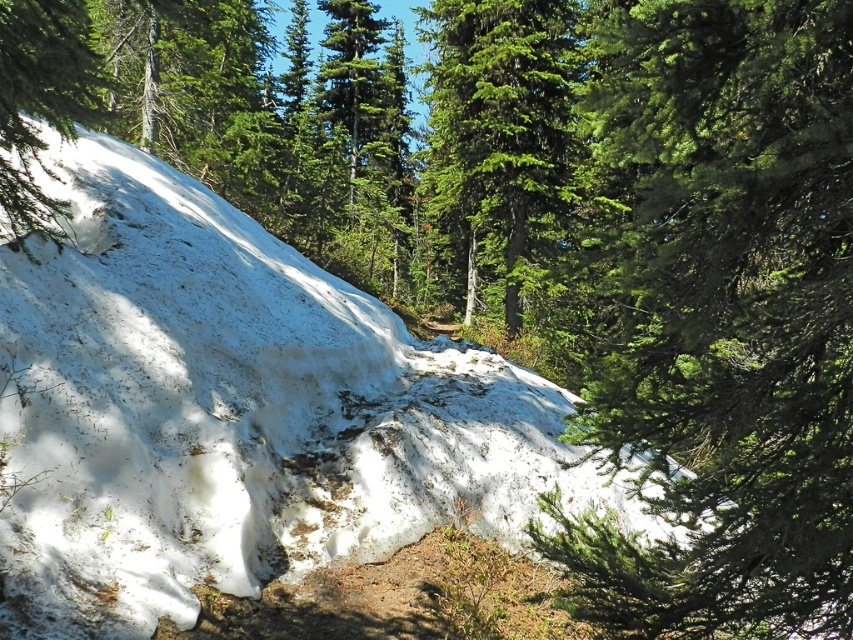
You are standing at the bottom of the snow slope on the left side of the image. You notice a green textured pine tree at upper right. Can you determine if the pine tree is located to the left or right of the point marked at coordinates point (724,317)?

The green textured pine tree at upper right is located at point (724,317), so the pine tree is exactly at the marked point.

You are a hiker trying to navigate through the forest. You see a green textured pine tree at upper right and a green matte tree at upper left. Which tree is closer to you?

The green textured pine tree at upper right is closer to you because it is in front of the green matte tree at upper left.